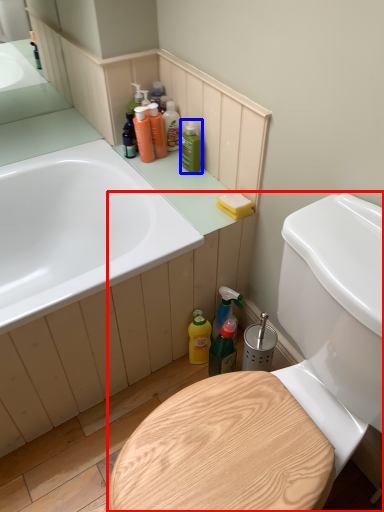
Question: Which point is closer to the camera, toilet (highlighted by a red box) or cleaning product (highlighted by a blue box)?

Choices:
 (A) toilet
 (B) cleaning product

Answer: (A)